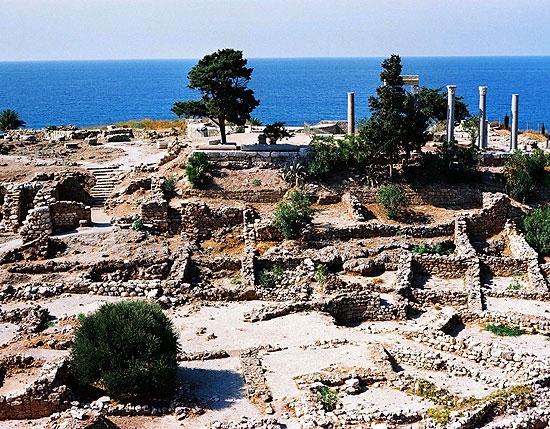
At what (x,y) coordinates should I click in order to perform the action: click on stairs. Please return your answer as a coordinate pair (x, y). Looking at the image, I should click on (102, 180).